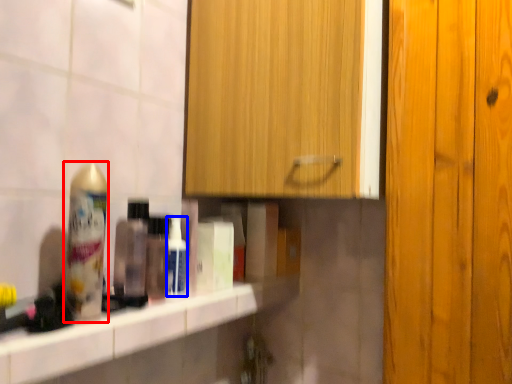
Question: Which point is closer to the camera, shaving cream (highlighted by a red box) or mouthwash (highlighted by a blue box)?

Choices:
 (A) shaving cream
 (B) mouthwash

Answer: (A)